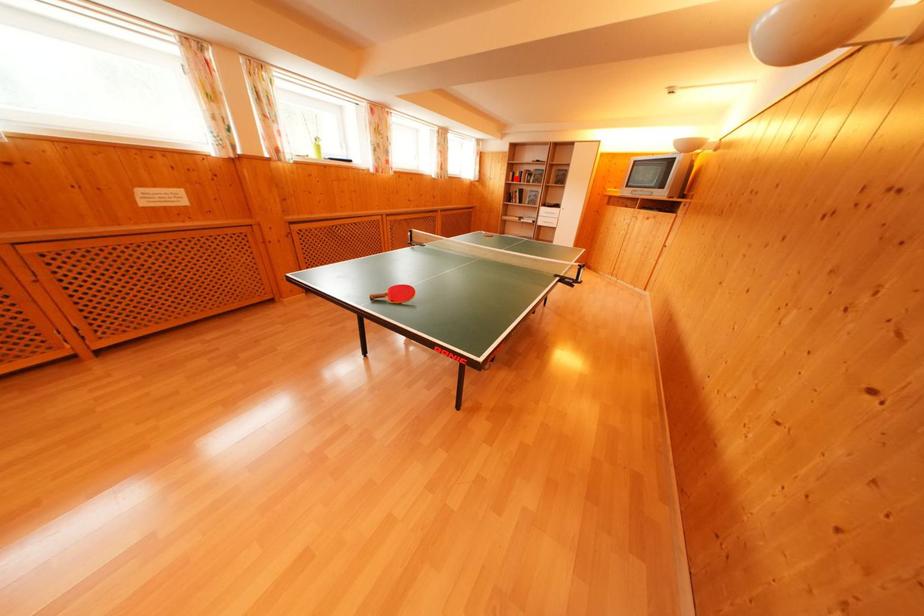
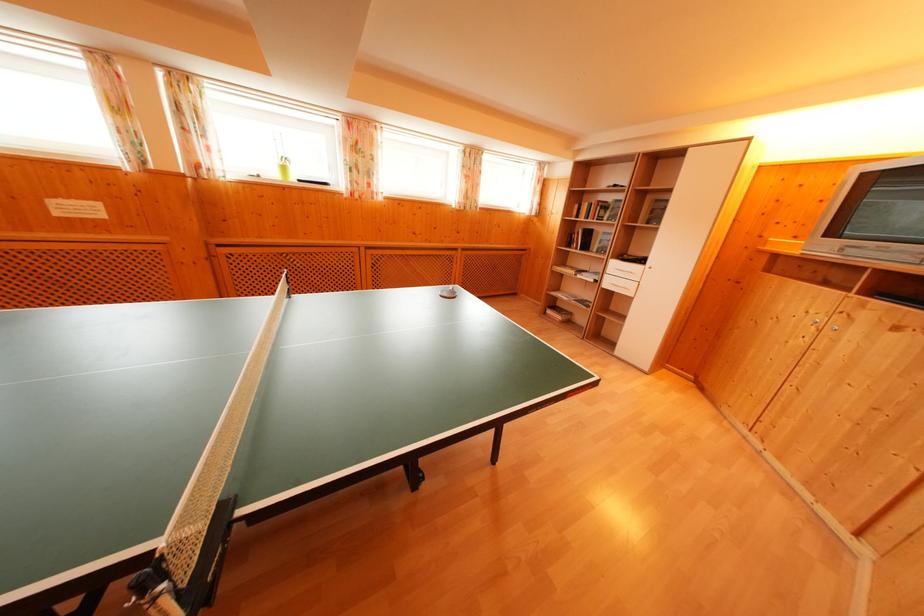
The point at the highlighted location is marked in the first image. Where is the corresponding point in the second image?

(581, 211)